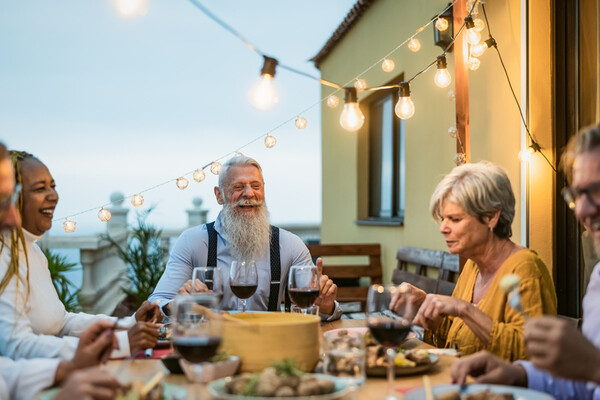
This screenshot has width=600, height=400. Find the location of `wine glasses`. wine glasses is located at coordinates (387, 319), (308, 277), (244, 283), (212, 282), (187, 352).